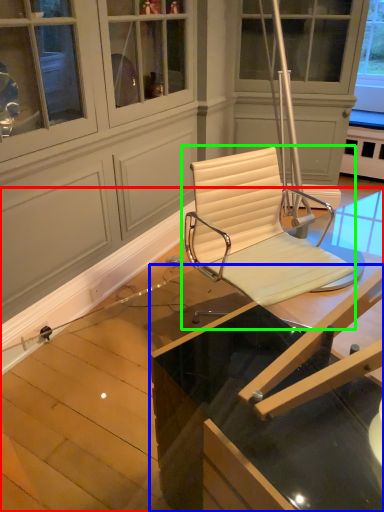
Question: Based on their relative distances, which object is nearer to table (highlighted by a red box)? Choose from table (highlighted by a blue box) and chair (highlighted by a green box).

Choices:
 (A) table
 (B) chair

Answer: (B)